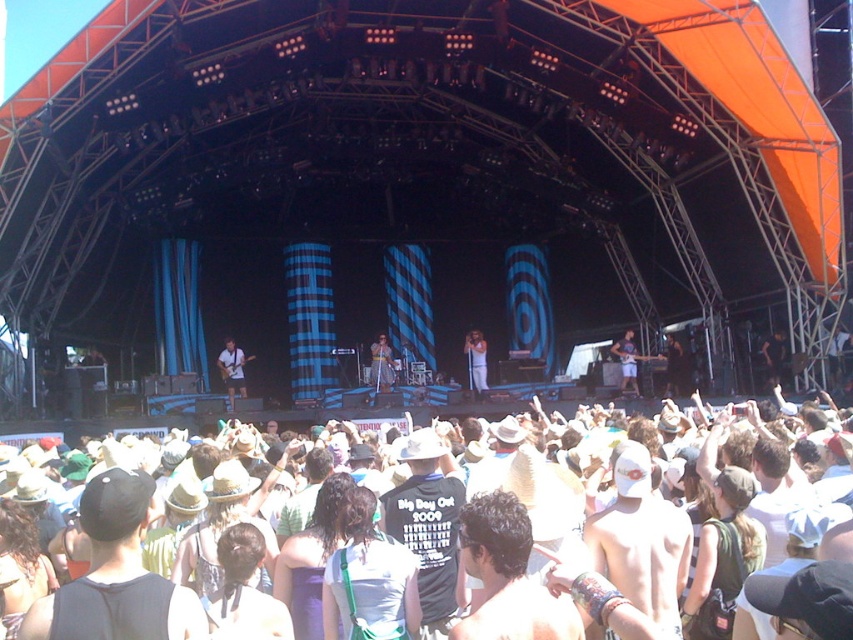
You are a photographer at the concert and want to capture a photo of the musician wearing the white fabric shirt at center and holding the shiny silver microphone at center. Based on their positions, which object should be placed on the left side of the photo?

The shiny silver microphone at center should be placed on the left side of the photo because the white fabric shirt at center is to the right of it.

You are a photographer standing at the back of the concert venue and want to take a photo of both the matte white guitar at center and the shiny silver guitar at center. Given that your camera has a maximum focus range of 60 meters, will you be able to capture both guitars in focus without moving closer?

The distance between the matte white guitar at center and the shiny silver guitar at center is 61.99 meters. Since the camera can only focus up to 60 meters, you won not be able to capture both guitars in focus without moving closer.